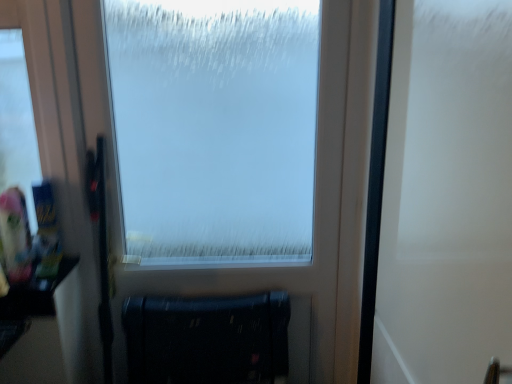
Question: Relative to white matte screen door at right, is frosted glass window at center in front or behind?

Choices:
 (A) front
 (B) behind

Answer: (B)

Question: From their relative heights in the image, would you say frosted glass window at center is taller or shorter than white matte screen door at right?

Choices:
 (A) short
 (B) tall

Answer: (B)

Question: Estimate the real-world distances between objects in this image. Which object is farther from the frosted glass window at center?

Choices:
 (A) matte black radiator at lower center
 (B) white matte screen door at right

Answer: (B)

Question: Based on their relative distances, which object is farther from the matte black radiator at lower center?

Choices:
 (A) white matte screen door at right
 (B) frosted glass window at center

Answer: (A)